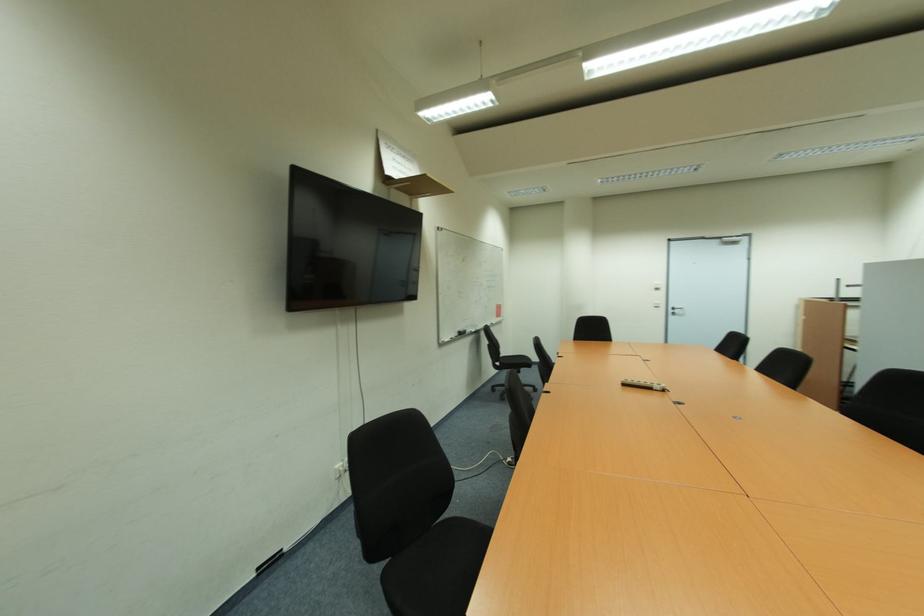
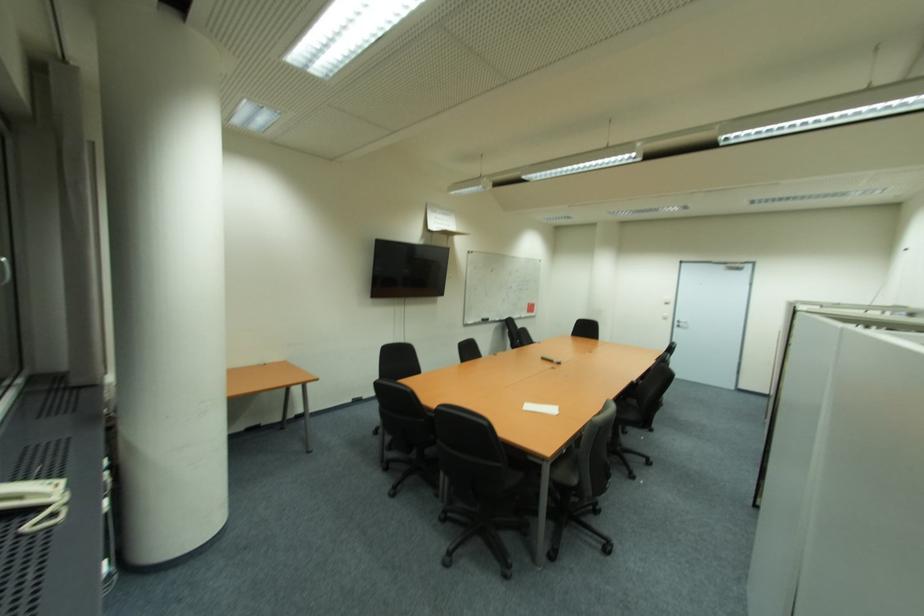
In the second image, find the point that corresponds to (679,312) in the first image.

(686, 325)